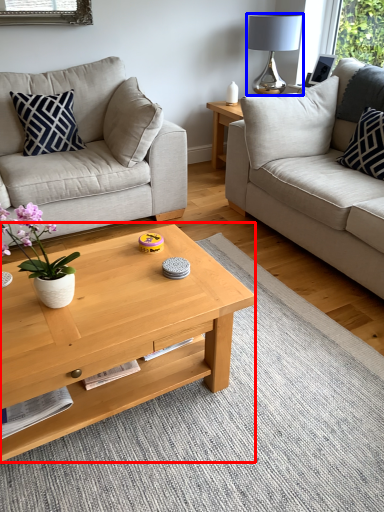
Question: Which point is further to the camera, coffee table (highlighted by a red box) or lamp (highlighted by a blue box)?

Choices:
 (A) coffee table
 (B) lamp

Answer: (B)